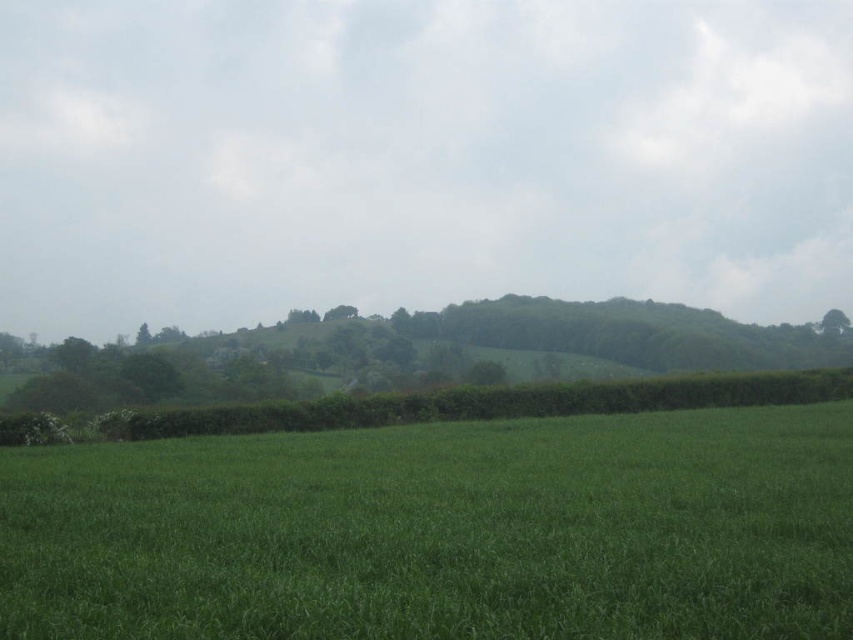
You are standing in the middle of the green grassy pasture at lower center and want to reach the green leafy tree at upper right. Which direction should you walk to get closer to the tree?

You should walk towards the upper right direction to get closer to the green leafy tree at upper right since it is located in that direction and the pasture is in front of it.

You are standing at the point labeled as point (440, 531) in the image. Looking around, what do you see immediately around you?

You are standing on the green grassy pasture at lower center located at point (440, 531).